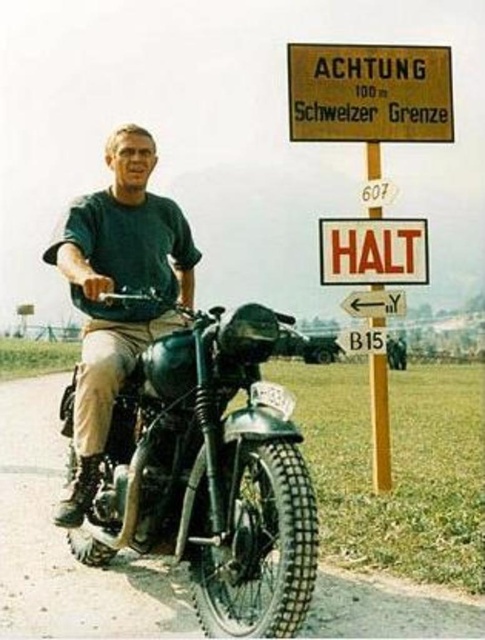
Question: Which point is closer to the camera?

Choices:
 (A) orange plastic sign at center
 (B) shiny black motorcycle at center

Answer: (B)

Question: Is the position of green matte shirt at center less distant than that of yellow cardboard sign at upper center?

Choices:
 (A) no
 (B) yes

Answer: (B)

Question: Is green matte shirt at center below yellow cardboard sign at upper center?

Choices:
 (A) yes
 (B) no

Answer: (A)

Question: Estimate the real-world distances between objects in this image. Which object is farther from the orange plastic sign at center?

Choices:
 (A) shiny black motorcycle at center
 (B) green matte shirt at center
 (C) yellow cardboard sign at upper center

Answer: (A)

Question: Which of the following is the closest to the observer?

Choices:
 (A) (426, 230)
 (B) (433, 56)

Answer: (A)

Question: Does green matte shirt at center lie behind orange plastic sign at center?

Choices:
 (A) yes
 (B) no

Answer: (B)